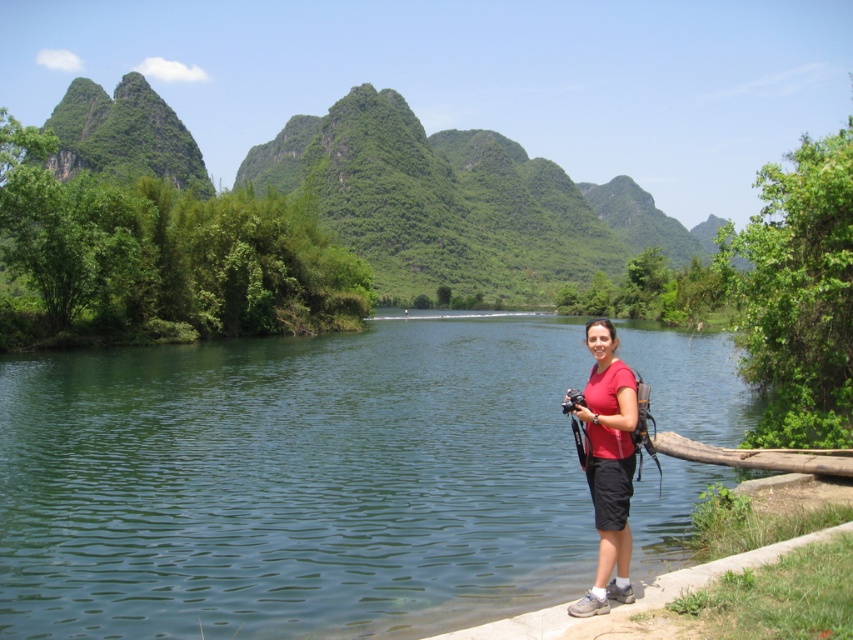
You are standing at the edge of the water and see the green smooth water at center and the red matte shirt at lower right. Which object is closer to your right side?

The red matte shirt at lower right is closer to your right side because it is positioned to the right of the green smooth water at center.

You are standing at the edge of the water and want to take a photo of the red matte shirt at lower right without the green smooth water at center blocking the view. Is it possible?

A: The red matte shirt at lower right is behind the green smooth water at center, so it is blocked by the water and cannot be seen without moving the water or the shirt.

You are standing at the edge of the green smooth water at center and looking towards the red matte shirt at lower right. Which object is taller from your perspective?

The red matte shirt at lower right is taller than the green smooth water at center.